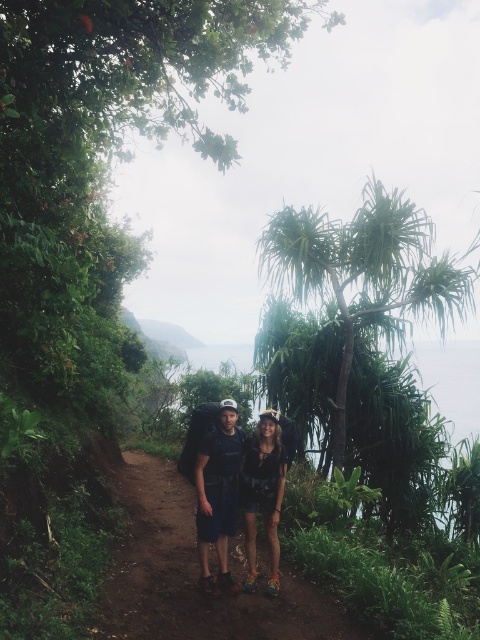
You are a hiker standing on the narrow dirt path between the two individuals. You want to take a photo of the green leafy tree at center without moving from your current position. Is the tree within your field of view?

The green leafy tree at center is located at point [364,275], which means it is directly in front of you. Since you are standing on the path between the two individuals, the tree should be within your field of view.

You are a hiker planning to walk along the dirt path at center while carrying your matte black backpack at center. Given the size difference between them, do you think your backpack might get stuck anywhere on the path?

The dirt path at center is larger in size than the matte black backpack at center, so the backpack should not get stuck as it is smaller than the path.